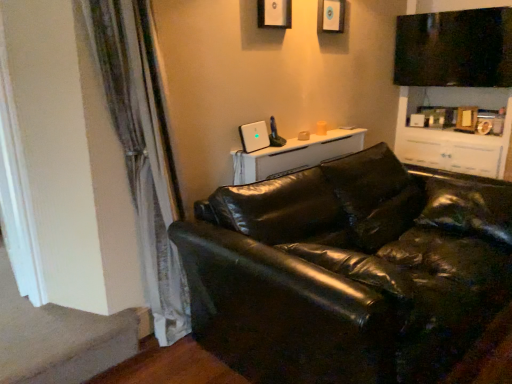
Question: In which direction should I rotate to look at matte black picture frame at upper center, which is counted as the 1th picture frame, starting from the front?

Choices:
 (A) left
 (B) right

Answer: (B)

Question: Would you say black leather couch at lower right contains carpet at lower left?

Choices:
 (A) no
 (B) yes

Answer: (A)

Question: Does black leather couch at lower right appear on the right side of carpet at lower left?

Choices:
 (A) no
 (B) yes

Answer: (B)

Question: From the image's perspective, does black leather couch at lower right appear lower than carpet at lower left?

Choices:
 (A) no
 (B) yes

Answer: (A)

Question: Does black leather couch at lower right turn towards carpet at lower left?

Choices:
 (A) no
 (B) yes

Answer: (A)

Question: Are black leather couch at lower right and carpet at lower left making contact?

Choices:
 (A) yes
 (B) no

Answer: (B)

Question: Is black leather couch at lower right located outside carpet at lower left?

Choices:
 (A) yes
 (B) no

Answer: (A)

Question: From a real-world perspective, is carpet at lower left positioned over silky white curtain at left based on gravity?

Choices:
 (A) yes
 (B) no

Answer: (B)

Question: Does carpet at lower left have a lesser width compared to silky white curtain at left?

Choices:
 (A) no
 (B) yes

Answer: (A)

Question: Is carpet at lower left oriented away from silky white curtain at left?

Choices:
 (A) yes
 (B) no

Answer: (B)

Question: From the image's perspective, is carpet at lower left on top of silky white curtain at left?

Choices:
 (A) yes
 (B) no

Answer: (B)

Question: Is carpet at lower left bigger than silky white curtain at left?

Choices:
 (A) yes
 (B) no

Answer: (B)

Question: From the image's perspective, does carpet at lower left appear lower than silky white curtain at left?

Choices:
 (A) yes
 (B) no

Answer: (A)

Question: Is carpet at lower left aimed at matte white picture frame at upper center, the 1th picture frame positioned from the back?

Choices:
 (A) yes
 (B) no

Answer: (B)